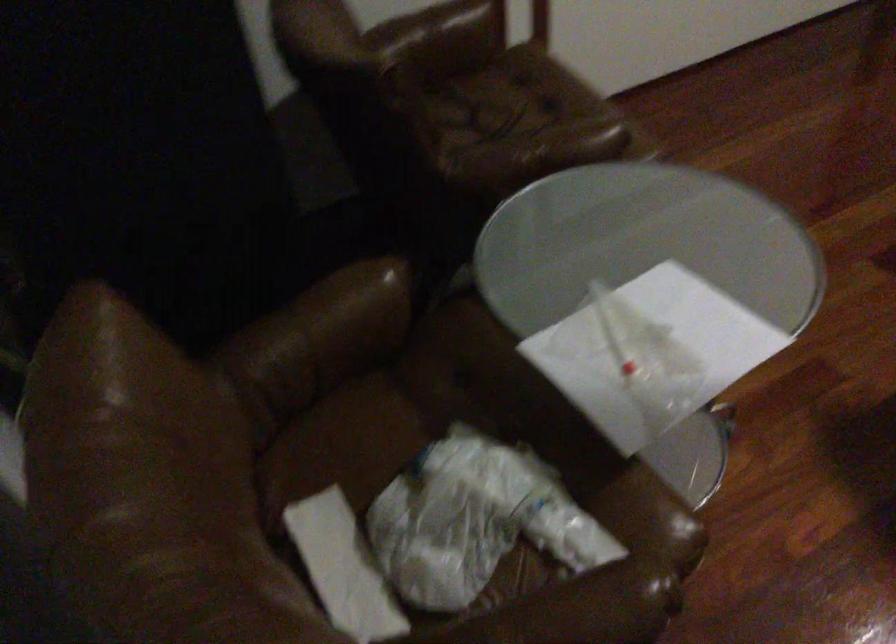
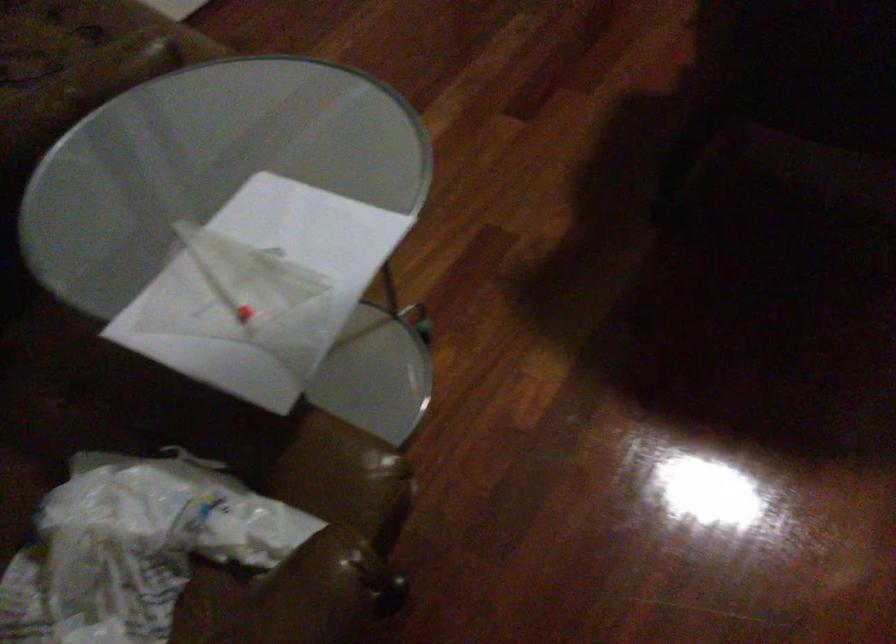
From the picture: In a continuous first-person perspective shot, in which direction is the camera moving?

The cameraman moved toward right, forward.